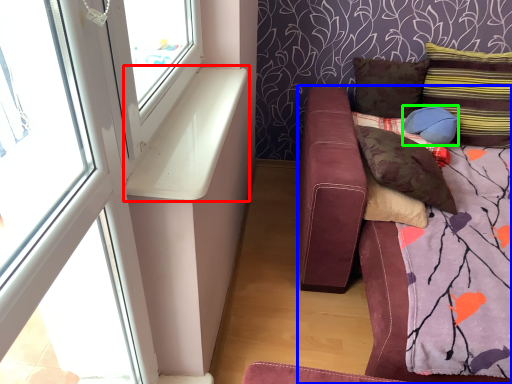
Question: Which is farther away from window sill (highlighted by a red box)? studio couch (highlighted by a blue box) or pillow (highlighted by a green box)?

Choices:
 (A) studio couch
 (B) pillow

Answer: (B)